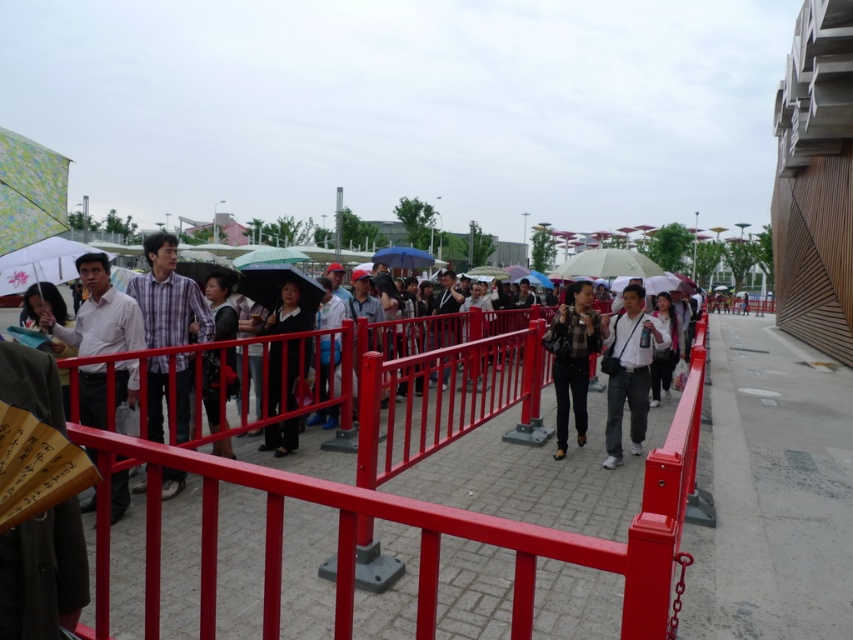
You are a photographer trying to capture a photo of both the black matte jacket at center and the black fabric jacket at center. Since you want both jackets to appear clearly in the frame, which jacket should you focus on first to ensure depth of field?

You should focus on the black fabric jacket at center first because it is narrower than the black matte jacket at center. By focusing on the narrower jacket, you can ensure that the depth of field will cover both jackets more effectively.

You are a photographer trying to capture a clear shot of both the black matte jacket at center and the black fabric jacket at center through the red metal barrier fence. Since the fence is in the way, you need to adjust your position. Which jacket will you focus on first to ensure it stays in frame while moving closer?

The black matte jacket at center is much taller than the black fabric jacket at center, so focusing on the taller jacket first will ensure it remains visible and in frame as you adjust your position closer to the fence.

You are standing in the scene and want to see the people behind the metallic red fence at center. Can you see the white matte shirt at center from your current position?

The metallic red fence at center is above the white matte shirt at center, so you can see the white matte shirt at center as the fence is positioned above it and not blocking the view.